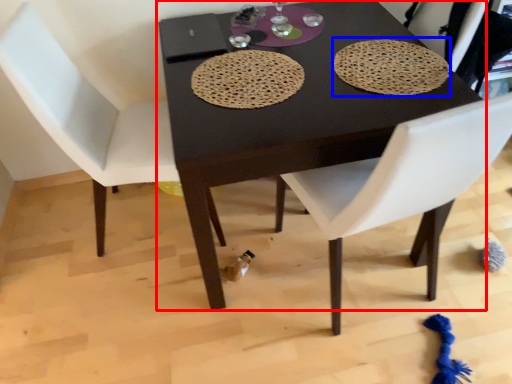
Question: Which object is further to the camera taking this photo, table (highlighted by a red box) or mat (highlighted by a blue box)?

Choices:
 (A) table
 (B) mat

Answer: (B)